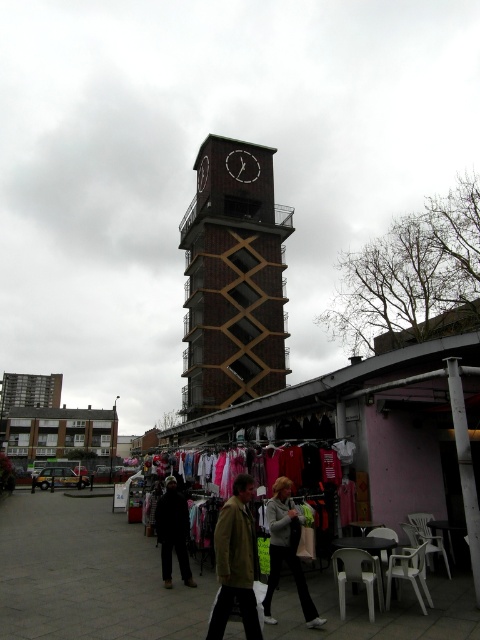
You are a city planner trying to install a new information board between the brown brick clock tower at center and the white wooden clock at center. Considering their widths, which object should the board be placed closer to in order to maintain balance?

The brown brick clock tower at center is wider than the white wooden clock at center. To maintain balance, the information board should be placed closer to the white wooden clock at center since it is narrower.

You are a customer at the market stall and want to buy the dark fabric jacket at center. You notice the black matte clock at upper center above the stall. Since you want to compare their sizes, can you tell me which one is bigger?

The black matte clock at upper center is bigger than the dark fabric jacket at center.